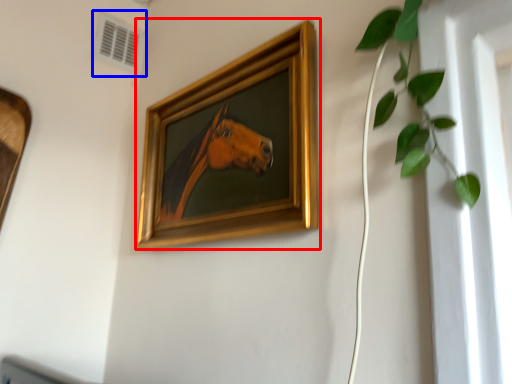
Question: Which object is further to the camera taking this photo, picture frame (highlighted by a red box) or air conditioning (highlighted by a blue box)?

Choices:
 (A) picture frame
 (B) air conditioning

Answer: (B)